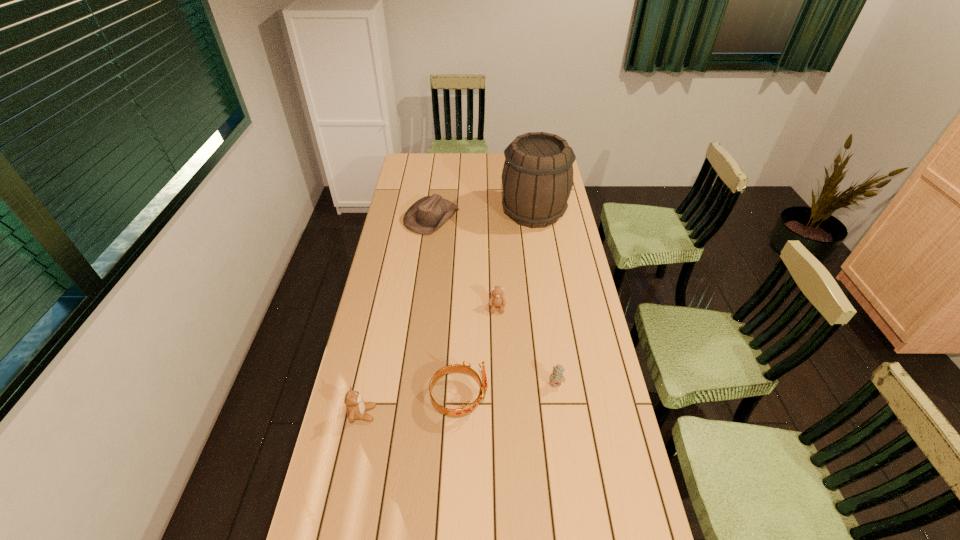
Identify the location of free region that satisfies the following two spatial constraints: 1. on the front-facing side of the second farthest teddy bear; 2. on the front-facing side of the tallest teddy bear. The image size is (960, 540). (561, 414).

You are a GUI agent. You are given a task and a screenshot of the screen. Output one action in this format:
    pyautogui.click(x=<x>, y=<y>)
    Task: Click on the free space that satisfies the following two spatial constraints: 1. on the front-facing side of the fourth nearest object; 2. on the front-facing side of the tallest teddy bear
    The image size is (960, 540).
    Given the screenshot: What is the action you would take?
    pyautogui.click(x=501, y=414)